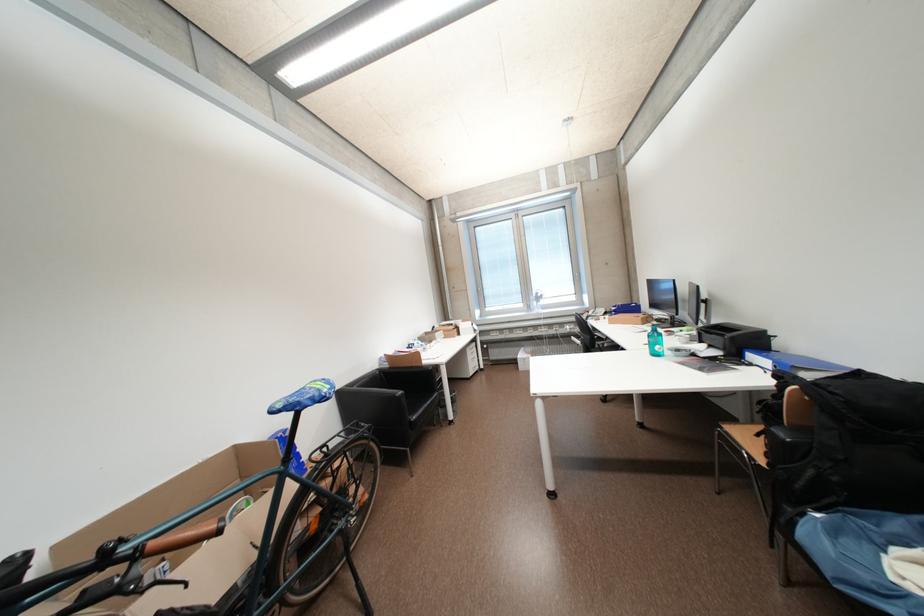
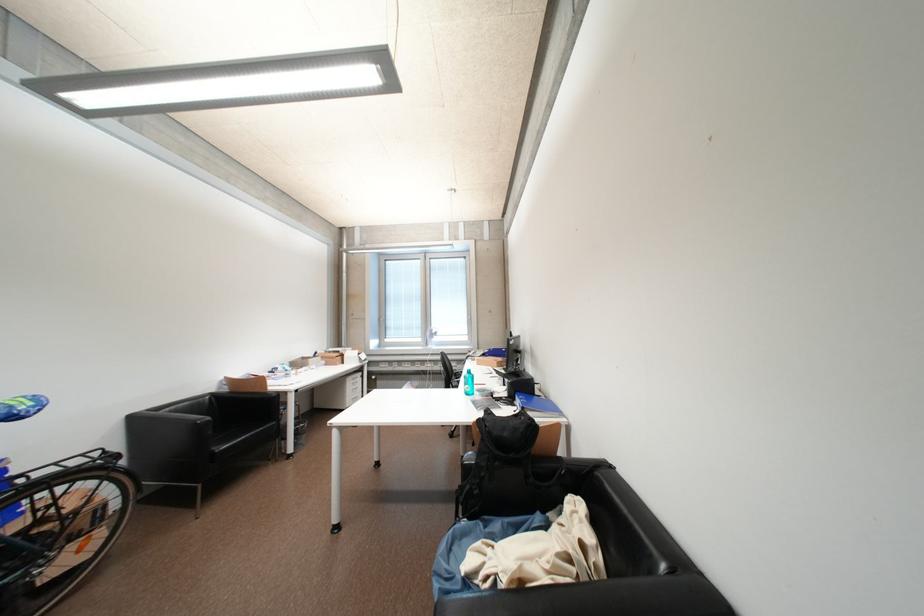
The images are taken continuously from a first-person perspective. In which direction are you moving?

The movement direction of the cameraman is right, backward.